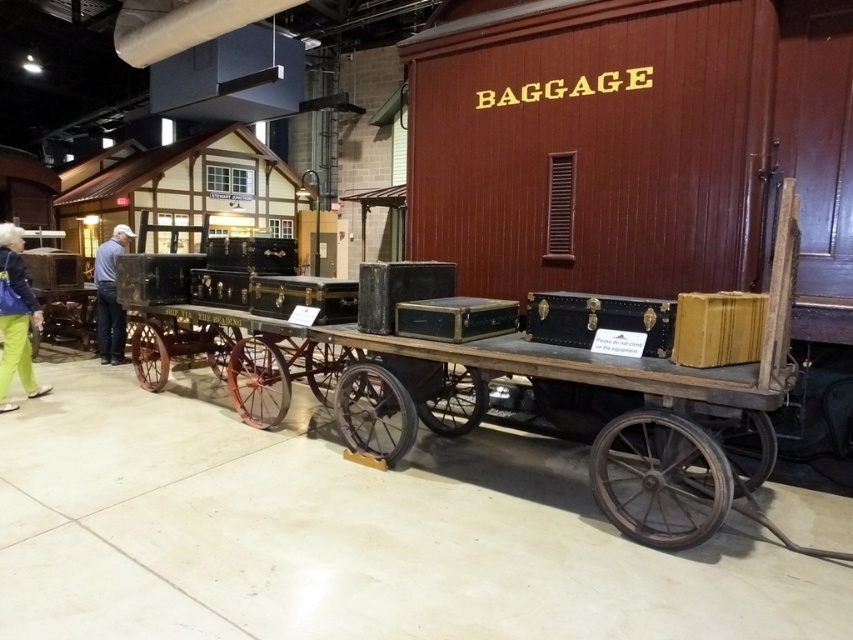
Based on the photo, you are standing in the museum and see two points marked in the image. The first point is at coordinate point(22,332) and the second is at point(117,317). Which point is closer to you?

Point(22,332) is in front of point(117,317), so it is closer to you.

You are standing at point (x=0, y=321). The baggage cart is 17.83 feet away from you. Can you estimate how far the baggage cart is from the nearest wall in the exhibit?

The baggage cart is 17.83 feet away from you at point (x=0, y=321). However, without knowing the exact dimensions of the exhibit or the position of the walls, it is impossible to determine the distance between the baggage cart and the nearest wall.

You are a museum visitor standing in front of the vintage baggage cart. You notice a green fabric bag at lower left and blue jeans at left. Which item is positioned lower in the scene?

The green fabric bag at lower left is positioned lower than the blue jeans at left.